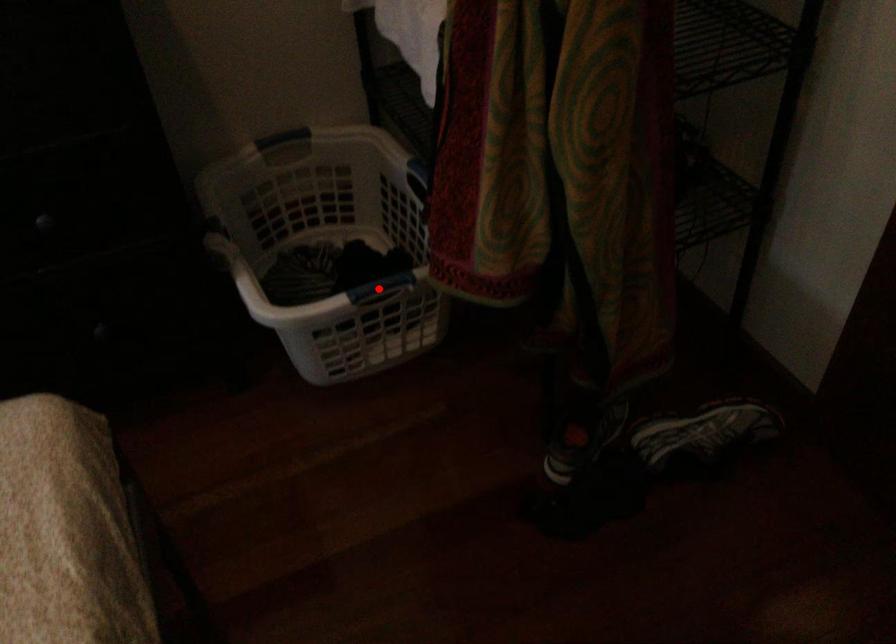
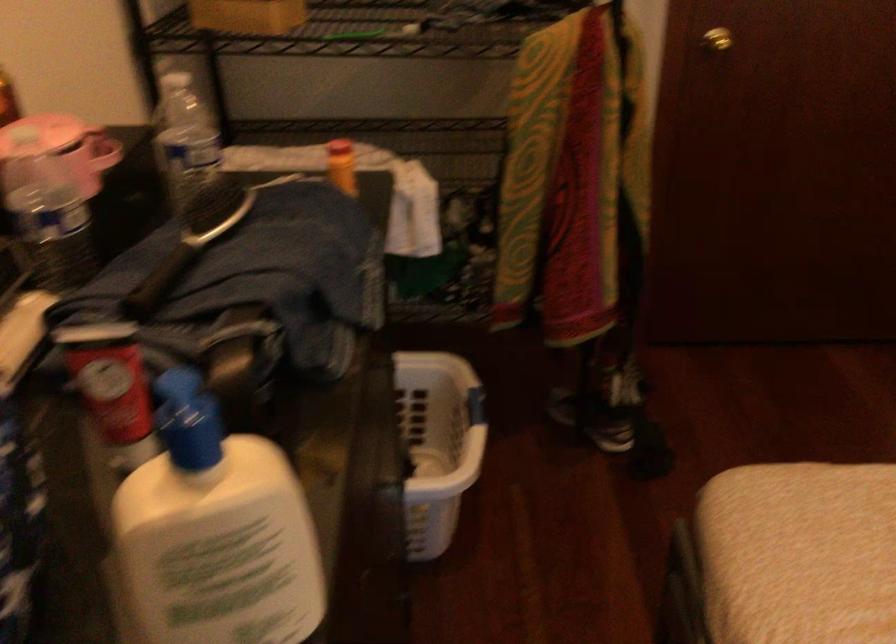
Question: I am providing you with two images of the same scene from different viewpoints. A red point is marked on the first image. Can you still see the location of the red point in image 2?

Choices:
 (A) Yes
 (B) No

Answer: (B)